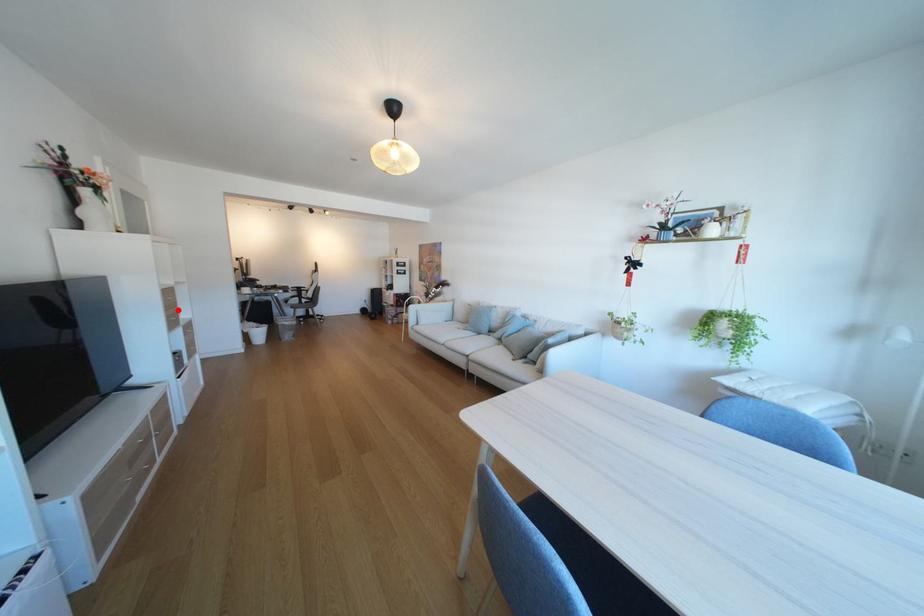
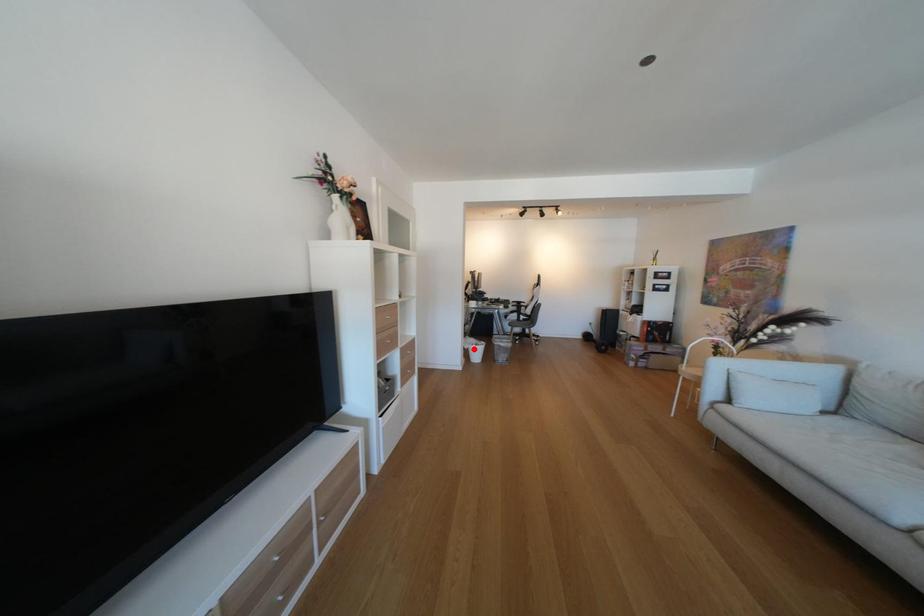
I am providing you with two images of the same scene from different viewpoints. A red point is marked on the first image and another point is marked on the second image. Do the highlighted points in image1 and image2 indicate the same real-world spot?

No